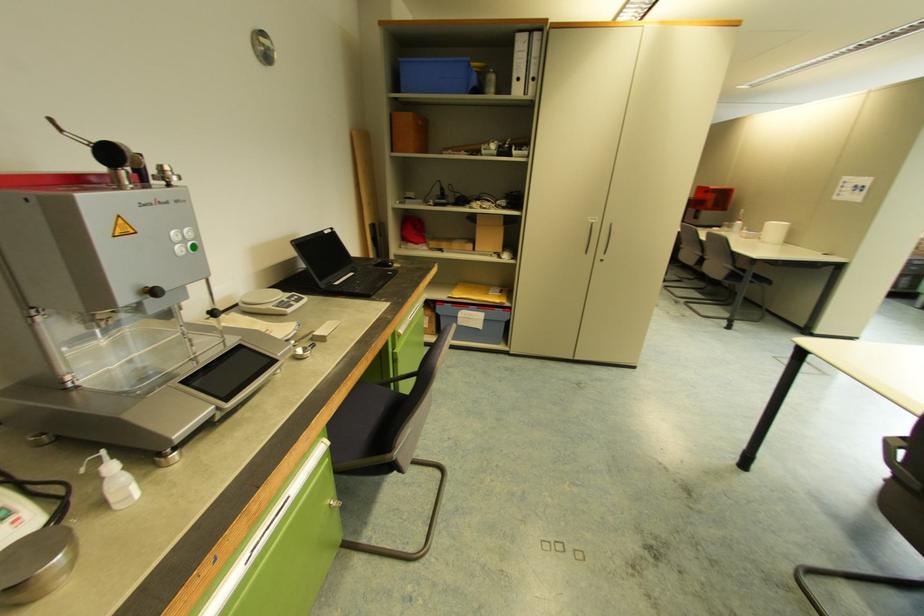
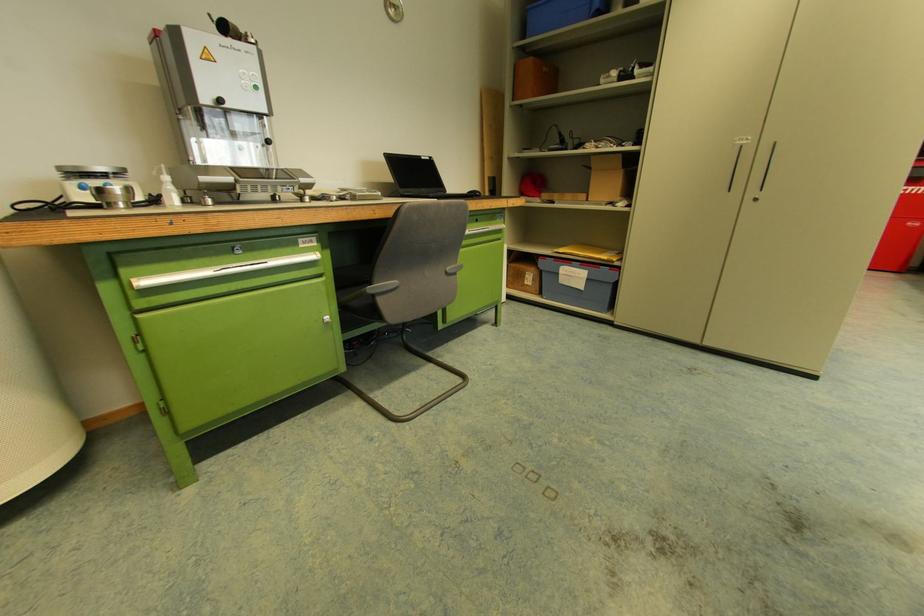
Locate, in the second image, the point that corresponds to (x=489, y=320) in the first image.

(591, 280)